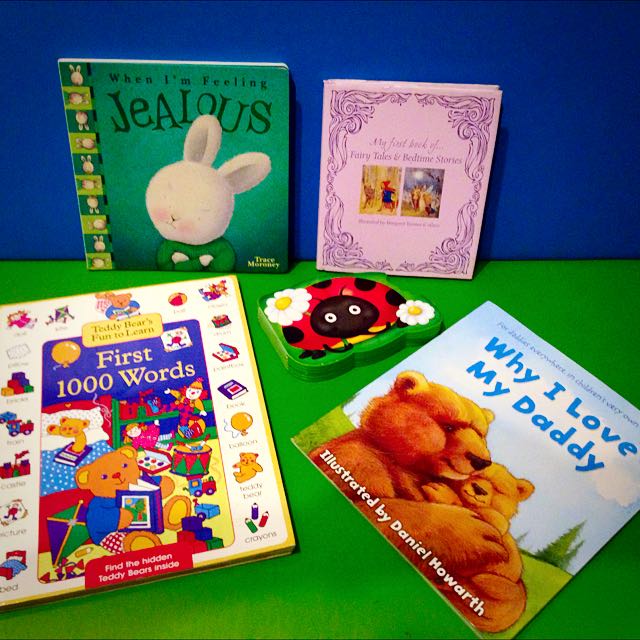
Identify the location of book, when i'm feeling jealous. The width and height of the screenshot is (640, 640). (109, 88).